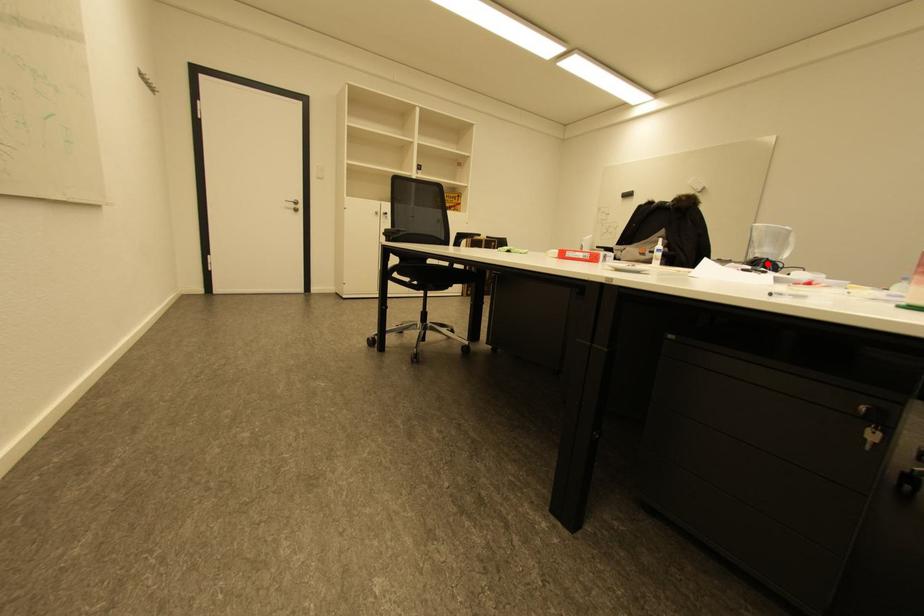
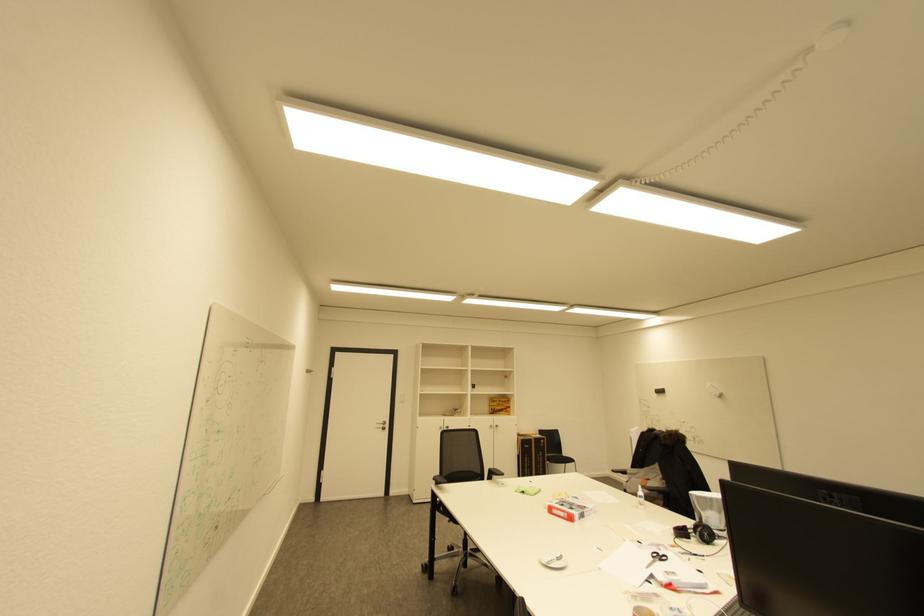
Find the pixel in the second image that matches the highlighted location in the first image.

(704, 533)